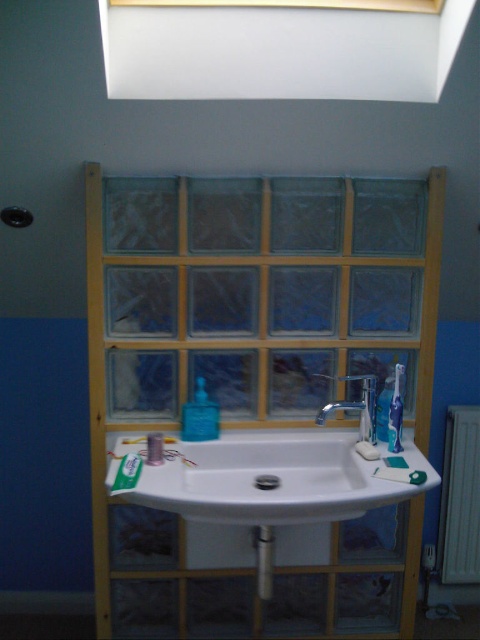
Is clear glass window at center bigger than silver metallic faucet at center?

Yes, clear glass window at center is bigger than silver metallic faucet at center.

Is clear glass window at center thinner than silver metallic faucet at center?

Incorrect, clear glass window at center's width is not less than silver metallic faucet at center's.

Locate an element on the screen. This screenshot has height=640, width=480. clear glass window at center is located at coordinates [262, 292].

Is white matte toothpaste at center closer to camera compared to white plastic toothpaste at center?

No, it is not.

Is white matte toothpaste at center thinner than white plastic toothpaste at center?

Yes, white matte toothpaste at center is thinner than white plastic toothpaste at center.

The height and width of the screenshot is (640, 480). Identify the location of white matte toothpaste at center. (396, 413).

Is clear glass window at center to the right of translucent plastic soap dispenser at sink from the viewer's perspective?

Yes, clear glass window at center is to the right of translucent plastic soap dispenser at sink.

Who is higher up, clear glass window at center or translucent plastic soap dispenser at sink?

clear glass window at center

Where is `clear glass window at center`? clear glass window at center is located at coordinates point(262,292).

Identify the location of clear glass window at center. (262, 292).